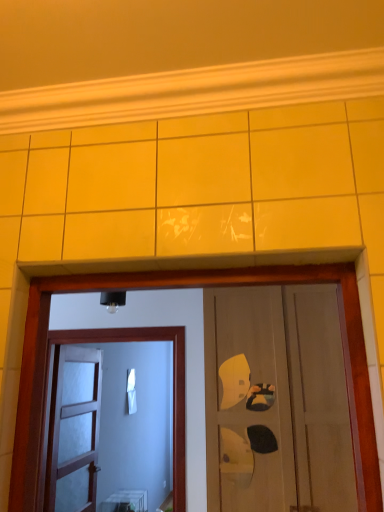
Describe the element at coordinates (277, 400) in the screenshot. This screenshot has width=384, height=512. I see `matte wooden door at center, which appears as the 1th door when viewed from the right` at that location.

Image resolution: width=384 pixels, height=512 pixels. In order to click on matte wooden door at center, which appears as the 1th door when viewed from the right in this screenshot , I will do `click(277, 400)`.

Locate an element on the screen. translucent glass door at center, which appears as the third door when viewed from the right is located at coordinates (74, 430).

From the image's perspective, would you say translucent glass door at center, which appears as the third door when viewed from the right, is positioned over matte wooden door at center, marked as the second door in a left-to-right arrangement?

Actually, translucent glass door at center, which appears as the third door when viewed from the right, appears below matte wooden door at center, marked as the second door in a left-to-right arrangement, in the image.

Considering the relative sizes of translucent glass door at center, the first door from the left, and matte wooden door at center, arranged as the 2th door when viewed from the right, in the image provided, is translucent glass door at center, the first door from the left, wider than matte wooden door at center, arranged as the 2th door when viewed from the right,?

Yes.

Between point (96, 370) and point (105, 338), which one is positioned in front?

Point (105, 338)

Does matte wooden door at center, marked as the second door in a left-to-right arrangement, have a lesser height compared to translucent glass door at center, the first door from the left?

Indeed, matte wooden door at center, marked as the second door in a left-to-right arrangement, has a lesser height compared to translucent glass door at center, the first door from the left.

Which is more to the right, matte wooden door at center, marked as the second door in a left-to-right arrangement, or translucent glass door at center, which appears as the third door when viewed from the right?

matte wooden door at center, marked as the second door in a left-to-right arrangement, is more to the right.

What's the angular difference between matte wooden door at center, arranged as the 2th door when viewed from the right, and translucent glass door at center, which appears as the third door when viewed from the right,'s facing directions?

matte wooden door at center, arranged as the 2th door when viewed from the right, and translucent glass door at center, which appears as the third door when viewed from the right, are facing 90.9 degrees away from each other.

Considering the relative positions of matte wooden door at center, which appears as the 1th door when viewed from the right, and translucent glass door at center, the first door from the left, in the image provided, is matte wooden door at center, which appears as the 1th door when viewed from the right, to the right of translucent glass door at center, the first door from the left, from the viewer's perspective?

Indeed, matte wooden door at center, which appears as the 1th door when viewed from the right, is positioned on the right side of translucent glass door at center, the first door from the left.

Is matte wooden door at center, which appears as the 1th door when viewed from the right, situated inside translucent glass door at center, which appears as the third door when viewed from the right, or outside?

matte wooden door at center, which appears as the 1th door when viewed from the right, exists outside the volume of translucent glass door at center, which appears as the third door when viewed from the right.

Relative to translucent glass door at center, the first door from the left, is matte wooden door at center, which appears as the 1th door when viewed from the right, in front or behind?

Clearly, matte wooden door at center, which appears as the 1th door when viewed from the right, is in front of translucent glass door at center, the first door from the left.

Where is `the 2nd door positioned above the translucent glass door at center, which appears as the third door when viewed from the right (from a real-world perspective)`? the 2nd door positioned above the translucent glass door at center, which appears as the third door when viewed from the right (from a real-world perspective) is located at coordinates (277, 400).

From the image's perspective, which is below, matte wooden door at center, the third door viewed from the left, or matte wooden door at center, marked as the second door in a left-to-right arrangement?

matte wooden door at center, marked as the second door in a left-to-right arrangement.

Considering the relative sizes of matte wooden door at center, the third door viewed from the left, and matte wooden door at center, arranged as the 2th door when viewed from the right, in the image provided, is matte wooden door at center, the third door viewed from the left, taller than matte wooden door at center, arranged as the 2th door when viewed from the right,?

Indeed, matte wooden door at center, the third door viewed from the left, has a greater height compared to matte wooden door at center, arranged as the 2th door when viewed from the right.

Does point (305, 354) appear closer or farther from the camera than point (117, 337)?

Point (305, 354) appears to be closer to the viewer than point (117, 337).

Can you confirm if matte wooden door at center, which appears as the 1th door when viewed from the right, is smaller than matte wooden door at center, arranged as the 2th door when viewed from the right?

Incorrect, matte wooden door at center, which appears as the 1th door when viewed from the right, is not smaller in size than matte wooden door at center, arranged as the 2th door when viewed from the right.

Is matte wooden door at center, arranged as the 2th door when viewed from the right, to the right of matte wooden door at center, which appears as the 1th door when viewed from the right, from the viewer's perspective?

No, matte wooden door at center, arranged as the 2th door when viewed from the right, is not to the right of matte wooden door at center, which appears as the 1th door when viewed from the right.

From the picture: How much distance is there between matte wooden door at center, marked as the second door in a left-to-right arrangement, and matte wooden door at center, the third door viewed from the left?

matte wooden door at center, marked as the second door in a left-to-right arrangement, is 21.03 inches away from matte wooden door at center, the third door viewed from the left.

Which door is the 1st one when counting from the back of the matte wooden door at center, which appears as the 1th door when viewed from the right? Please provide its 2D coordinates.

[(173, 392)]

Is matte wooden door at center, the third door viewed from the left, inside matte wooden door at center, marked as the second door in a left-to-right arrangement?

No, matte wooden door at center, the third door viewed from the left, is not a part of matte wooden door at center, marked as the second door in a left-to-right arrangement.

From the image's perspective, is translucent glass door at center, which appears as the third door when viewed from the right, above or below matte wooden door at center, the third door viewed from the left?

From the image's perspective, translucent glass door at center, which appears as the third door when viewed from the right, appears below matte wooden door at center, the third door viewed from the left.

Can you tell me how much translucent glass door at center, the first door from the left, and matte wooden door at center, which appears as the 1th door when viewed from the right, differ in facing direction?

They differ by 90.9 degrees in their facing directions.

Is translucent glass door at center, the first door from the left, taller or shorter than matte wooden door at center, which appears as the 1th door when viewed from the right?

Clearly, translucent glass door at center, the first door from the left, is shorter compared to matte wooden door at center, which appears as the 1th door when viewed from the right.

From a real-world perspective, is translucent glass door at center, which appears as the third door when viewed from the right, positioned above or below matte wooden door at center, which appears as the 1th door when viewed from the right?

translucent glass door at center, which appears as the third door when viewed from the right, is situated lower than matte wooden door at center, which appears as the 1th door when viewed from the right, in the real world.

This screenshot has height=512, width=384. I want to click on door that appears below the matte wooden door at center, marked as the second door in a left-to-right arrangement (from a real-world perspective), so click(74, 430).

Locate an element on the screen. door that is the 1st one when counting forward from the translucent glass door at center, the first door from the left is located at coordinates (173, 392).

Estimate the real-world distances between objects in this image. Which object is closer to translucent glass door at center, which appears as the third door when viewed from the right, matte wooden door at center, arranged as the 2th door when viewed from the right, or matte wooden door at center, the third door viewed from the left?

matte wooden door at center, arranged as the 2th door when viewed from the right, lies closer to translucent glass door at center, which appears as the third door when viewed from the right, than the other object.

Which object lies nearer to the anchor point matte wooden door at center, the third door viewed from the left, matte wooden door at center, arranged as the 2th door when viewed from the right, or translucent glass door at center, which appears as the third door when viewed from the right?

Based on the image, matte wooden door at center, arranged as the 2th door when viewed from the right, appears to be nearer to matte wooden door at center, the third door viewed from the left.

Considering their positions, is matte wooden door at center, the third door viewed from the left, positioned further to matte wooden door at center, arranged as the 2th door when viewed from the right, than translucent glass door at center, the first door from the left?

Among the two, translucent glass door at center, the first door from the left, is located further to matte wooden door at center, arranged as the 2th door when viewed from the right.

Looking at this image, which object lies further to the anchor point translucent glass door at center, which appears as the third door when viewed from the right, matte wooden door at center, the third door viewed from the left, or matte wooden door at center, marked as the second door in a left-to-right arrangement?

The object further to translucent glass door at center, which appears as the third door when viewed from the right, is matte wooden door at center, the third door viewed from the left.

Looking at the image, which one is located closer to matte wooden door at center, marked as the second door in a left-to-right arrangement, translucent glass door at center, the first door from the left, or matte wooden door at center, which appears as the 1th door when viewed from the right?

Based on the image, matte wooden door at center, which appears as the 1th door when viewed from the right, appears to be nearer to matte wooden door at center, marked as the second door in a left-to-right arrangement.

From the image, which object appears to be nearer to matte wooden door at center, which appears as the 1th door when viewed from the right, translucent glass door at center, the first door from the left, or matte wooden door at center, arranged as the 2th door when viewed from the right?

Among the two, matte wooden door at center, arranged as the 2th door when viewed from the right, is located nearer to matte wooden door at center, which appears as the 1th door when viewed from the right.

At what (x,y) coordinates should I click in order to perform the action: click on door between translucent glass door at center, the first door from the left, and matte wooden door at center, the third door viewed from the left, from left to right. Please return your answer as a coordinate pair (x, y). The image size is (384, 512). Looking at the image, I should click on (173, 392).